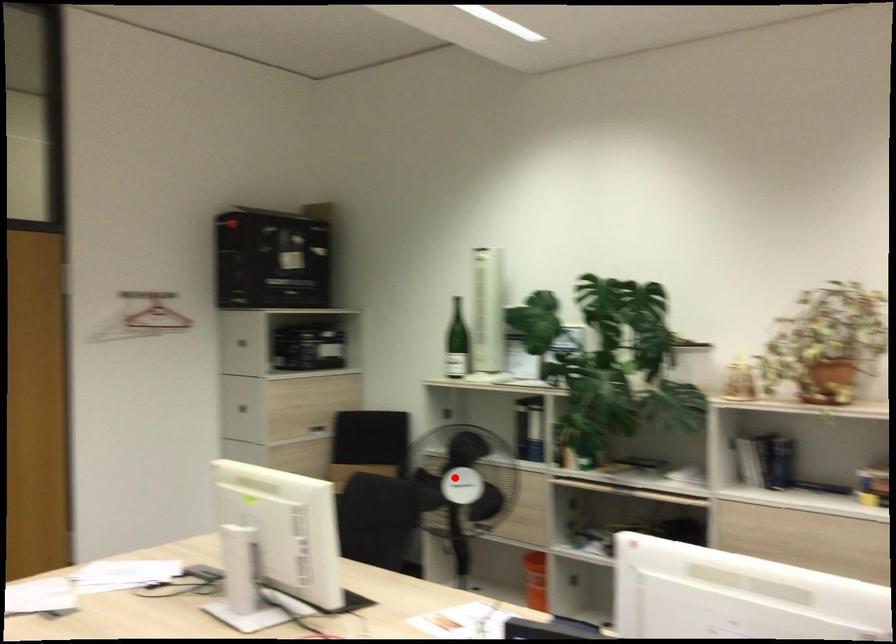
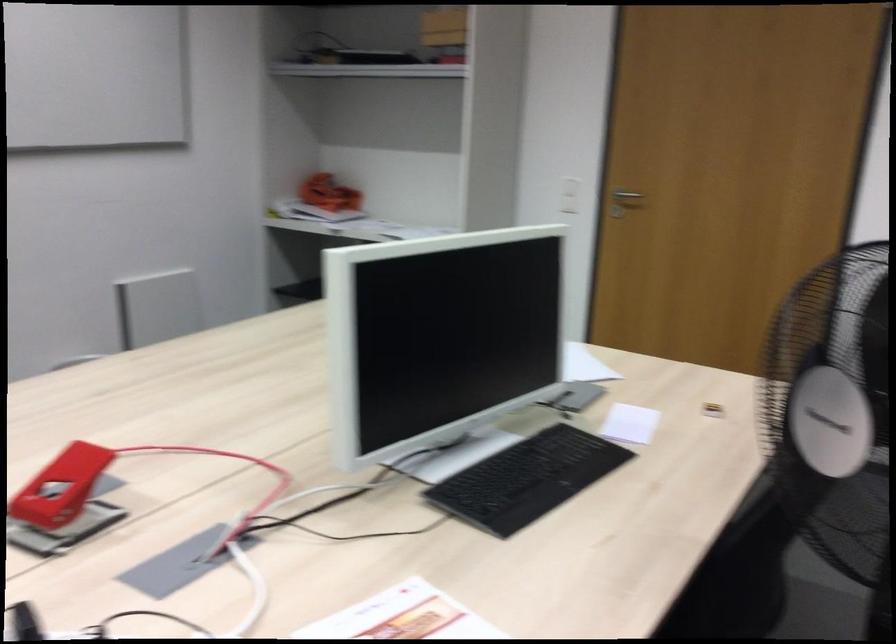
Find the pixel in the second image that matches the highlighted location in the first image.

(831, 408)